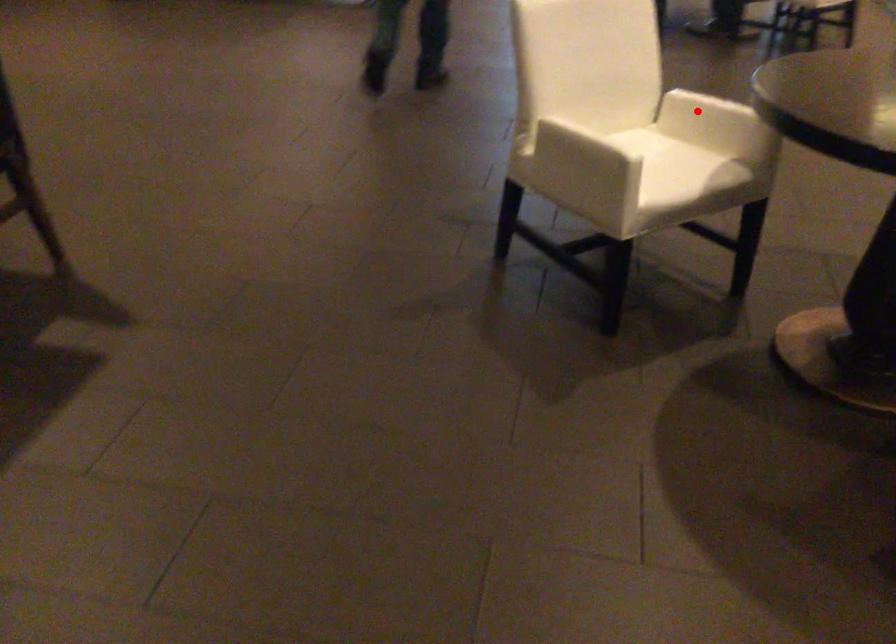
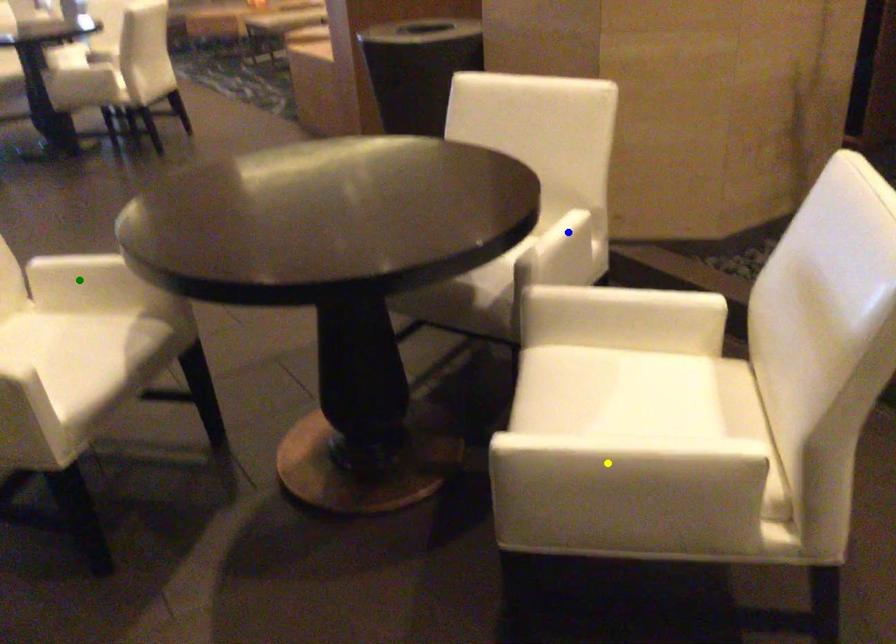
Question: I am providing you with two images of the same scene from different viewpoints. A red point is marked on the first image. You are given multiple points on the second image. Which mark in image 2 goes with the point in image 1?

Choices:
 (A) yellow point
 (B) blue point
 (C) green point

Answer: (C)